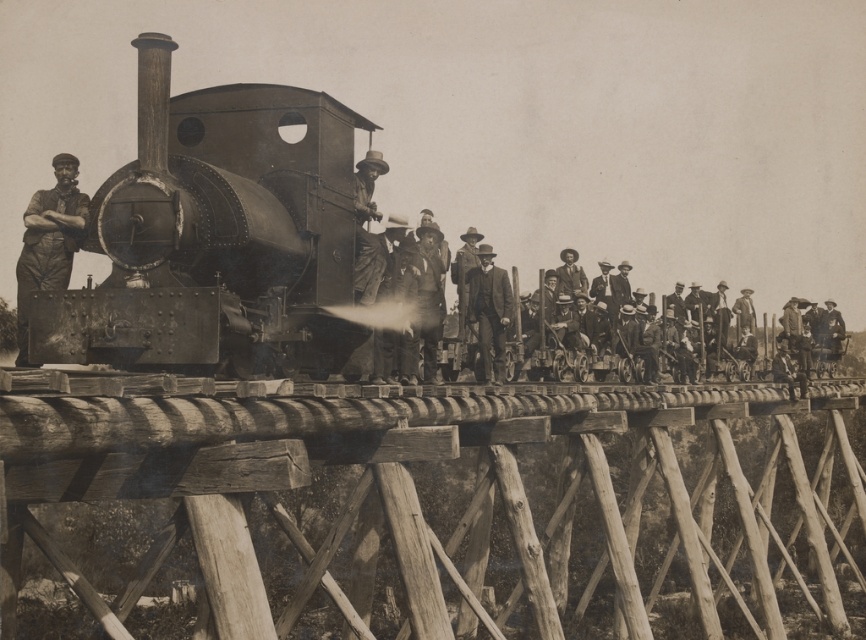
Question: Which point is farther to the camera?

Choices:
 (A) polished metal locomotive at center
 (B) smooth leather hat at center
 (C) smooth brown suit at center

Answer: (C)

Question: Is matte black steam locomotive at center to the right of smooth brown suit at center from the viewer's perspective?

Choices:
 (A) no
 (B) yes

Answer: (A)

Question: Does smooth brown suit at center appear under smooth leather hat at center?

Choices:
 (A) no
 (B) yes

Answer: (B)

Question: Based on their relative distances, which object is farther from the smooth brown suit at center?

Choices:
 (A) rusty metal man at center
 (B) matte black steam locomotive at center
 (C) polished metal locomotive at center

Answer: (A)

Question: Considering the relative positions of polished metal locomotive at center and matte black steam locomotive at center in the image provided, where is polished metal locomotive at center located with respect to matte black steam locomotive at center?

Choices:
 (A) below
 (B) above

Answer: (B)

Question: Which point appears farthest from the camera in this image?

Choices:
 (A) (441, 276)
 (B) (81, 195)
 (C) (173, 106)
 (D) (493, 358)

Answer: (D)